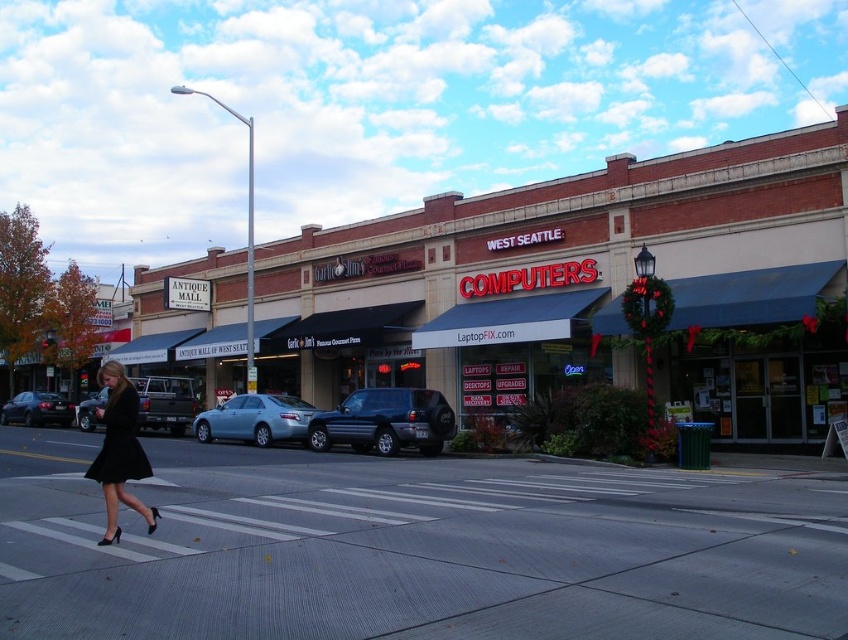
Question: Is satin silver suv at center behind black matte skirt at lower left?

Choices:
 (A) no
 (B) yes

Answer: (B)

Question: Which object is positioned closest to the satin blue sedan at center?

Choices:
 (A) black asphalt at center
 (B) black matte dress at lower left

Answer: (B)

Question: Does satin silver suv at center appear under silver metallic suv at center-left?

Choices:
 (A) no
 (B) yes

Answer: (A)

Question: Which point appears closest to the camera in this image?

Choices:
 (A) (82, 426)
 (B) (293, 428)
 (C) (342, 416)

Answer: (C)

Question: Does satin silver suv at center come in front of black matte skirt at lower left?

Choices:
 (A) yes
 (B) no

Answer: (B)

Question: Considering the real-world distances, which object is closest to the matte black sedan at lower left?

Choices:
 (A) silver metallic suv at center-left
 (B) black matte dress at lower left
 (C) satin silver suv at center
 (D) black asphalt at center

Answer: (A)